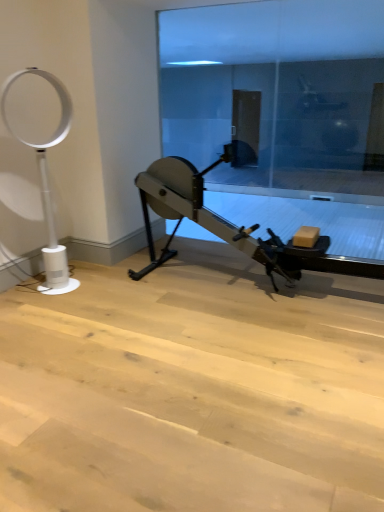
Question: From a real-world perspective, is transparent glass door at center under metallic gray stationary bicycle at center?

Choices:
 (A) no
 (B) yes

Answer: (A)

Question: Is transparent glass door at center positioned far away from metallic gray stationary bicycle at center?

Choices:
 (A) yes
 (B) no

Answer: (A)

Question: Is transparent glass door at center oriented away from metallic gray stationary bicycle at center?

Choices:
 (A) yes
 (B) no

Answer: (A)

Question: Can you confirm if transparent glass door at center is positioned to the left of metallic gray stationary bicycle at center?

Choices:
 (A) yes
 (B) no

Answer: (B)

Question: From the image's perspective, is transparent glass door at center on top of metallic gray stationary bicycle at center?

Choices:
 (A) yes
 (B) no

Answer: (A)

Question: Is white plastic fan at left to the left or to the right of metallic gray stationary bicycle at center in the image?

Choices:
 (A) right
 (B) left

Answer: (B)

Question: Looking at the image, does white plastic fan at left seem bigger or smaller compared to metallic gray stationary bicycle at center?

Choices:
 (A) small
 (B) big

Answer: (A)

Question: Considering the positions of white plastic fan at left and metallic gray stationary bicycle at center in the image, is white plastic fan at left taller or shorter than metallic gray stationary bicycle at center?

Choices:
 (A) short
 (B) tall

Answer: (B)

Question: Considering the positions of point (46, 221) and point (165, 167), is point (46, 221) closer or farther from the camera than point (165, 167)?

Choices:
 (A) farther
 (B) closer

Answer: (A)

Question: Relative to transparent glass door at center, is white plastic fan at left in front or behind?

Choices:
 (A) front
 (B) behind

Answer: (A)

Question: In terms of width, does white plastic fan at left look wider or thinner when compared to transparent glass door at center?

Choices:
 (A) wide
 (B) thin

Answer: (A)

Question: Is white plastic fan at left situated inside transparent glass door at center or outside?

Choices:
 (A) outside
 (B) inside

Answer: (A)

Question: Does point (49, 257) appear closer or farther from the camera than point (379, 240)?

Choices:
 (A) farther
 (B) closer

Answer: (A)

Question: Is transparent glass door at center taller or shorter than white plastic fan at left?

Choices:
 (A) short
 (B) tall

Answer: (B)

Question: From a real-world perspective, is transparent glass door at center physically located above or below white plastic fan at left?

Choices:
 (A) below
 (B) above

Answer: (B)